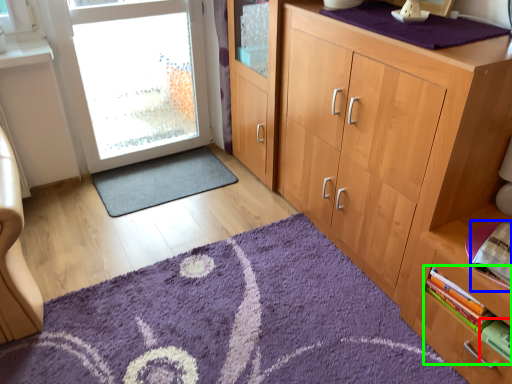
Question: Which is nearer to the book (highlighted by a red box)? book (highlighted by a blue box) or book (highlighted by a green box).

Choices:
 (A) book
 (B) book

Answer: (B)